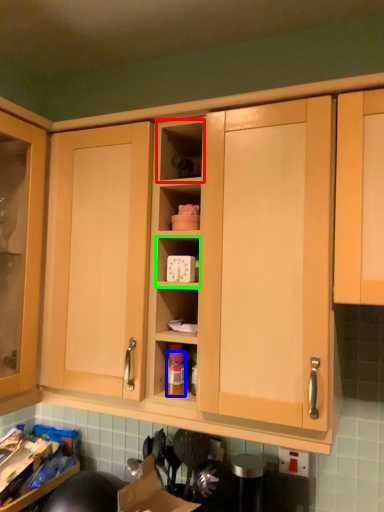
Question: Which object is the farthest from shelf (highlighted by a red box)? Choose among these: bottle (highlighted by a blue box) or cabinet (highlighted by a green box).

Choices:
 (A) bottle
 (B) cabinet

Answer: (A)